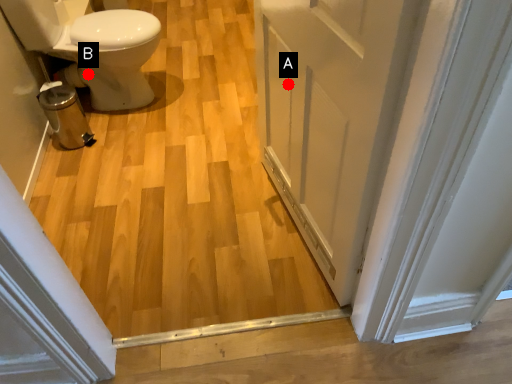
Question: Two points are circled on the image, labeled by A and B beside each circle. Among these points, which one is farthest from the camera?

Choices:
 (A) A is further
 (B) B is further

Answer: (B)